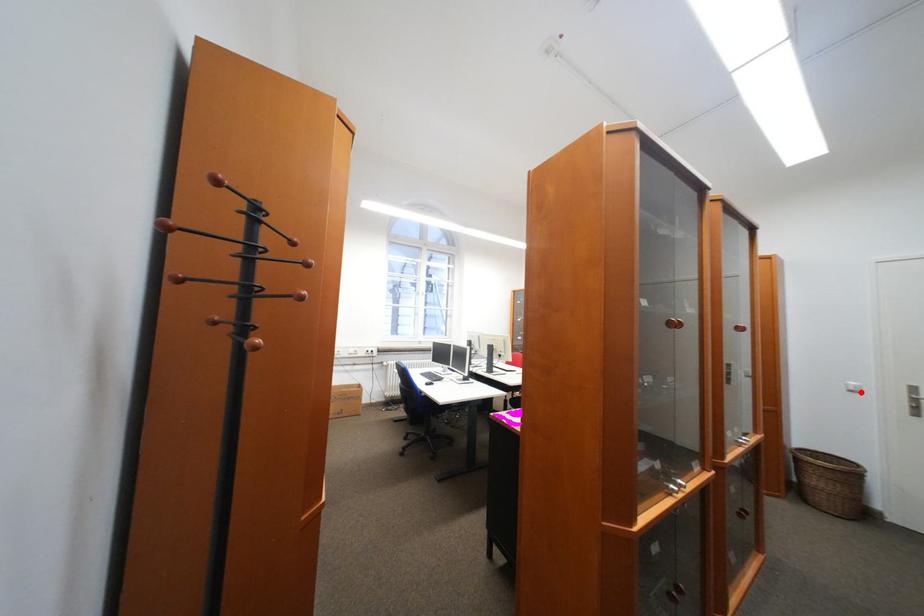
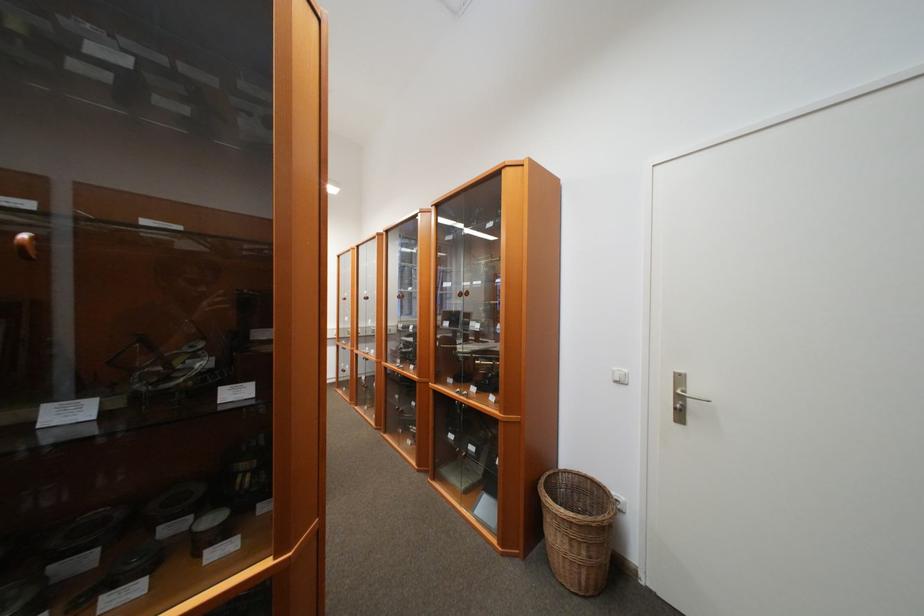
Locate, in the second image, the point that corresponds to the highlighted location in the first image.

(626, 383)